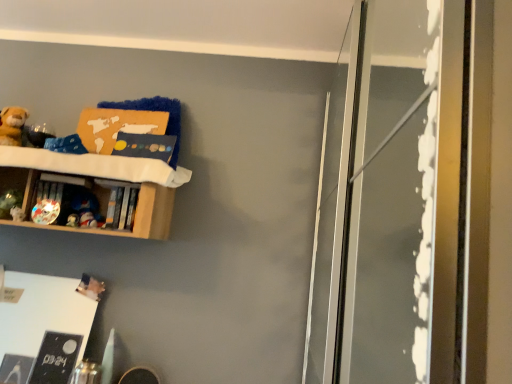
Question: Can you confirm if matte plastic toy at left, positioned as the fifth toy in top-to-bottom order, is smaller than wooden shelf at upper left?

Choices:
 (A) yes
 (B) no

Answer: (A)

Question: Does matte plastic toy at left, positioned as the fifth toy in top-to-bottom order, have a lesser height compared to wooden shelf at upper left?

Choices:
 (A) no
 (B) yes

Answer: (B)

Question: Does matte plastic toy at left, marked as the second toy in a bottom-to-top arrangement, appear on the right side of wooden shelf at upper left?

Choices:
 (A) yes
 (B) no

Answer: (A)

Question: Could you tell me if matte plastic toy at left, marked as the second toy in a bottom-to-top arrangement, is facing wooden shelf at upper left?

Choices:
 (A) yes
 (B) no

Answer: (A)

Question: Are matte plastic toy at left, positioned as the fifth toy in top-to-bottom order, and wooden shelf at upper left far apart?

Choices:
 (A) yes
 (B) no

Answer: (B)

Question: Does matte plastic toy at left, marked as the second toy in a bottom-to-top arrangement, touch wooden shelf at upper left?

Choices:
 (A) no
 (B) yes

Answer: (A)

Question: Does matte plastic toy at center-left, the 3th toy from the top, have a greater width compared to soft plush bear at upper left, the sixth toy when ordered from bottom to top?

Choices:
 (A) no
 (B) yes

Answer: (A)

Question: Is matte plastic toy at center-left, the 3th toy from the top, closer to the viewer compared to soft plush bear at upper left, which ranks as the 1th toy in top-to-bottom order?

Choices:
 (A) no
 (B) yes

Answer: (A)

Question: Is matte plastic toy at center-left, the 3th toy from the top, at the right side of soft plush bear at upper left, which ranks as the 1th toy in top-to-bottom order?

Choices:
 (A) yes
 (B) no

Answer: (A)

Question: Does matte plastic toy at center-left, the 3th toy from the top, touch soft plush bear at upper left, which ranks as the 1th toy in top-to-bottom order?

Choices:
 (A) yes
 (B) no

Answer: (B)

Question: Would you say matte plastic toy at center-left, the fourth toy ordered from the bottom, is outside soft plush bear at upper left, which ranks as the 1th toy in top-to-bottom order?

Choices:
 (A) no
 (B) yes

Answer: (B)

Question: From the image's perspective, is matte plastic toy at center-left, the fourth toy ordered from the bottom, on top of soft plush bear at upper left, which ranks as the 1th toy in top-to-bottom order?

Choices:
 (A) yes
 (B) no

Answer: (B)

Question: Does wooden shelf at upper left have a greater width compared to white matte board at lower left?

Choices:
 (A) no
 (B) yes

Answer: (B)